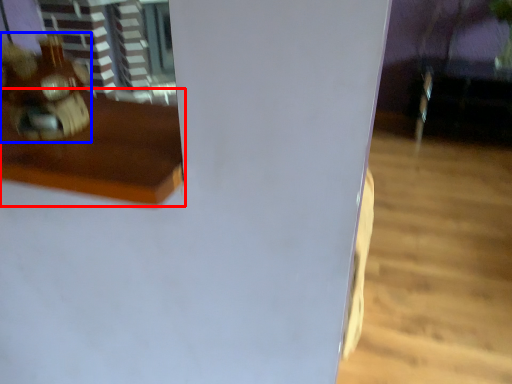
Question: Among these objects, which one is nearest to the camera, furniture (highlighted by a red box) or toy (highlighted by a blue box)?

Choices:
 (A) furniture
 (B) toy

Answer: (A)